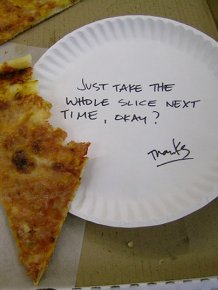
You are a GUI agent. You are given a task and a screenshot of the screen. Output one action in this format:
    pyautogui.click(x=<x>, y=<y>)
    Task: Click on the white plate
    The height and width of the screenshot is (290, 218).
    Given the screenshot: What is the action you would take?
    pyautogui.click(x=123, y=161)